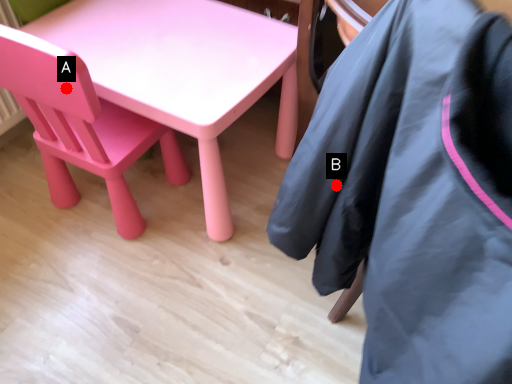
Question: Two points are circled on the image, labeled by A and B beside each circle. Which point is closer to the camera?

Choices:
 (A) A is closer
 (B) B is closer

Answer: (B)